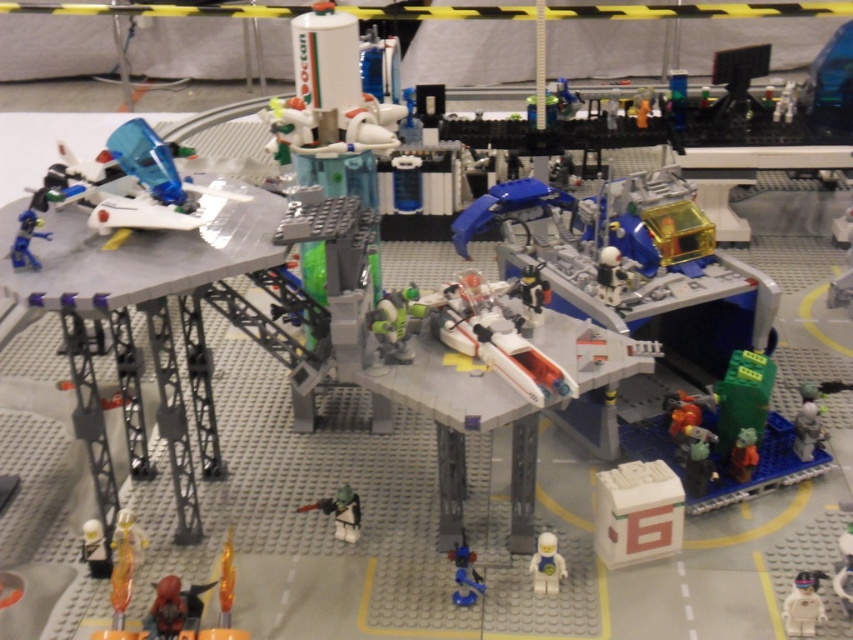
Based on the photo, you are assembling a LEGO set and need to place the shiny silver figure at lower left. According to the instructions, where should you position it relative to the other elements in the scene?

The shiny silver figure at lower left should be positioned at point coordinates [96,548] as specified in the instructions.

You are an astronaut preparing for a mission and see both the white matte helmet at center and the white plastic astronaut at center in your spacecraft. Which object is closer to you?

The white matte helmet at center is closer to you because the white plastic astronaut at center is behind it.

You are an astronaut preparing for a mission and notice two items at the center of the scene. Which item is directly above the other? The white matte helmet at center or the white plastic astronaut at center?

The white matte helmet at center is positioned over the white plastic astronaut at center, so the white matte helmet at center is directly above the white plastic astronaut at center.